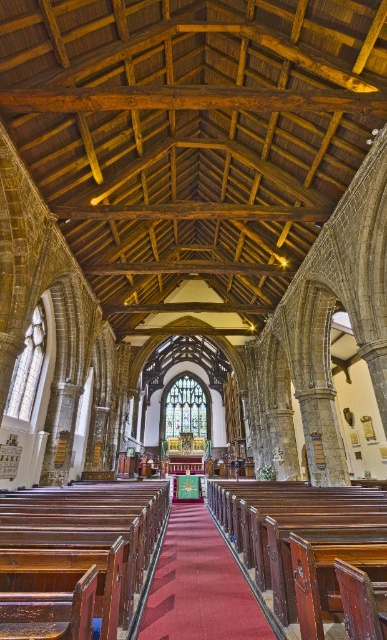
Can you confirm if polished wood church bench at center is thinner than smooth wooden aisle at center?

No, polished wood church bench at center is not thinner than smooth wooden aisle at center.

Can you confirm if polished wood church bench at center is smaller than smooth wooden aisle at center?

Actually, polished wood church bench at center might be larger than smooth wooden aisle at center.

At what (x,y) coordinates should I click in order to perform the action: click on polished wood church bench at center. Please return your answer as a coordinate pair (x, y). Image resolution: width=387 pixels, height=640 pixels. Looking at the image, I should click on (85, 544).

Does wooden polished bench at center appear under smooth wooden aisle at center?

Yes, wooden polished bench at center is below smooth wooden aisle at center.

Does wooden polished bench at center have a lesser height compared to smooth wooden aisle at center?

Incorrect, wooden polished bench at center's height does not fall short of smooth wooden aisle at center's.

Describe the element at coordinates (299, 541) in the screenshot. I see `wooden polished bench at center` at that location.

You are a GUI agent. You are given a task and a screenshot of the screen. Output one action in this format:
    pyautogui.click(x=<x>, y=<y>)
    Task: Click on the wooden polished bench at center
    
    Given the screenshot: What is the action you would take?
    pyautogui.click(x=299, y=541)

Can you confirm if polished wood church bench at center is bigger than wooden polished bench at center?

Actually, polished wood church bench at center might be smaller than wooden polished bench at center.

Between polished wood church bench at center and wooden polished bench at center, which one has less height?

With less height is polished wood church bench at center.

You are a GUI agent. You are given a task and a screenshot of the screen. Output one action in this format:
    pyautogui.click(x=<x>, y=<y>)
    Task: Click on the polished wood church bench at center
    
    Given the screenshot: What is the action you would take?
    pyautogui.click(x=85, y=544)

Locate an element on the screen. The width and height of the screenshot is (387, 640). polished wood church bench at center is located at coordinates (85, 544).